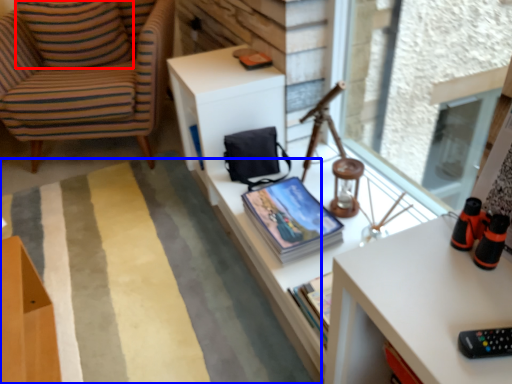
Question: Which point is closer to the camera, pillow (highlighted by a red box) or plain (highlighted by a blue box)?

Choices:
 (A) pillow
 (B) plain

Answer: (B)